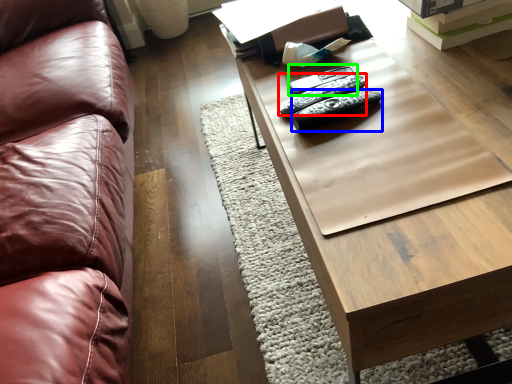
Question: Which object is the closest to the remote (highlighted by a red box)? Choose among these: remote (highlighted by a blue box) or remote (highlighted by a green box).

Choices:
 (A) remote
 (B) remote

Answer: (A)